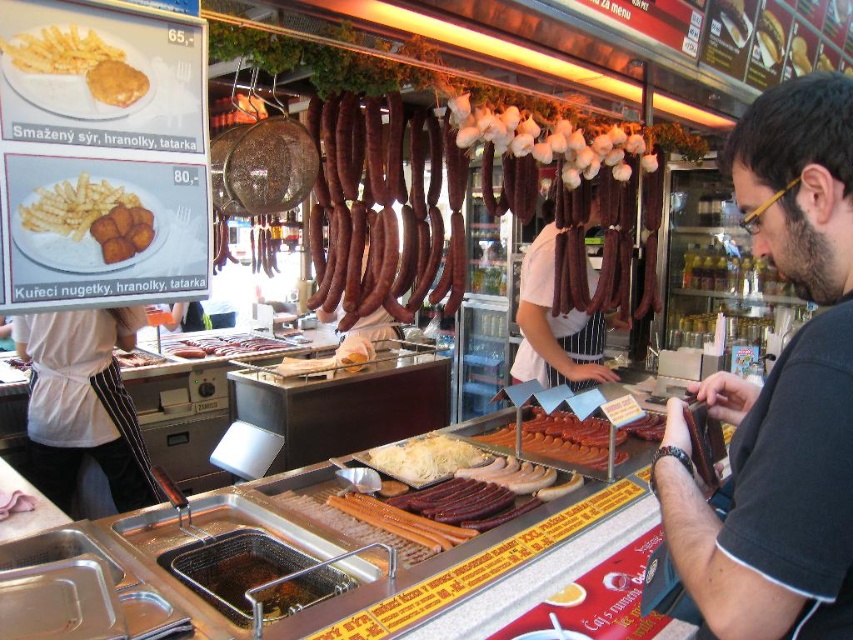
Question: Which object is positioned closest to the golden crispy nugget at left?

Choices:
 (A) white apron at center
 (B) dark brown leather wallet at center right

Answer: (B)

Question: Which of the following is the closest to the observer?

Choices:
 (A) (296, 600)
 (B) (148, 353)
 (C) (431, 472)
 (D) (222, 337)

Answer: (A)

Question: Can you confirm if brown matte sausages at center is bigger than shiny metal sausage at center?

Choices:
 (A) yes
 (B) no

Answer: (A)

Question: Does golden crispy nugget at left come in front of golden crispy fries at upper left?

Choices:
 (A) yes
 (B) no

Answer: (B)

Question: Does golden crispy nugget at left have a larger size compared to brown glossy sausages at center?

Choices:
 (A) no
 (B) yes

Answer: (A)

Question: Which point appears farthest from the camera in this image?

Choices:
 (A) (154, 225)
 (B) (521, 449)
 (C) (120, 349)
 (D) (469, 449)

Answer: (C)